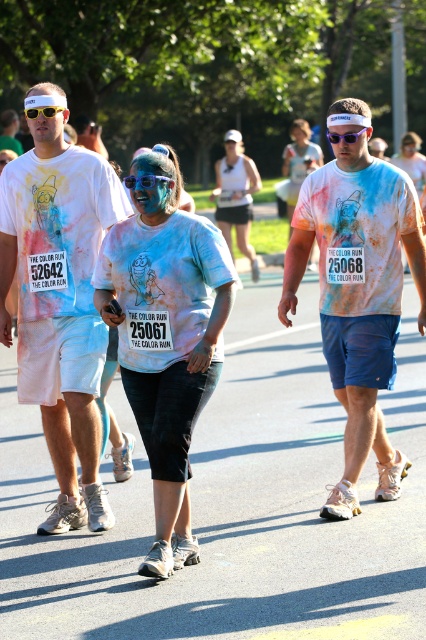
You are a photographer at The Color Run event and want to capture a closeup of the blue matte goggles at center. According to the coordinates provided, where exactly should you focus your camera lens?

The blue matte goggles at center are located at coordinates point (144, 180), so you should focus your camera lens there to capture the closeup.